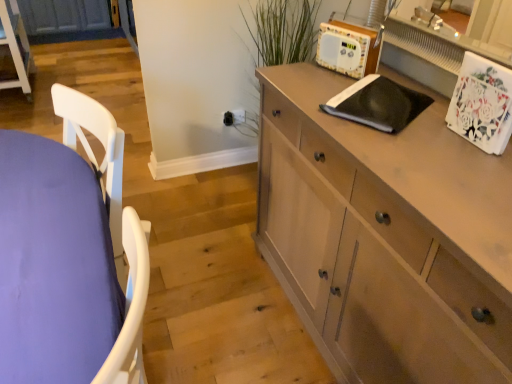
What do you see at coordinates (386, 237) in the screenshot? I see `light brown wood cabinet at right` at bounding box center [386, 237].

Image resolution: width=512 pixels, height=384 pixels. Identify the location of wooden radio at upper right. (349, 48).

Between light brown wood cabinet at right and light brown wood cabinet at lower left, which one is positioned behind?

light brown wood cabinet at lower left is behind.

Is light brown wood cabinet at right facing away from light brown wood cabinet at lower left?

light brown wood cabinet at right does not have its back to light brown wood cabinet at lower left.

From the picture: Is light brown wood cabinet at right completely or partially outside of light brown wood cabinet at lower left?

light brown wood cabinet at right is positioned outside light brown wood cabinet at lower left.

How far apart are light brown wood cabinet at right and light brown wood cabinet at lower left?

The distance of light brown wood cabinet at right from light brown wood cabinet at lower left is 3.20 meters.

Is green matte plant at upper center turned away from light brown wood cabinet at lower left?

No.

Can you see green matte plant at upper center touching light brown wood cabinet at lower left?

No, green matte plant at upper center is not touching light brown wood cabinet at lower left.

Is point (300, 44) closer to camera compared to point (1, 4)?

That is True.

Considering the relative sizes of green matte plant at upper center and light brown wood cabinet at lower left in the image provided, is green matte plant at upper center shorter than light brown wood cabinet at lower left?

Incorrect, the height of green matte plant at upper center does not fall short of that of light brown wood cabinet at lower left.

Does point (14, 2) appear closer or farther from the camera than point (33, 140)?

Point (14, 2) is farther from the camera than point (33, 140).

Where is `the chest of drawers above the purple fabric table at left (from the image's perspective)`? the chest of drawers above the purple fabric table at left (from the image's perspective) is located at coordinates (16, 47).

Is purple fabric table at left at the back of light brown wood cabinet at lower left?

That's not correct — light brown wood cabinet at lower left is not looking away from purple fabric table at left.

From the image's perspective, does light brown wood cabinet at lower left appear lower than purple fabric table at left?

No, from the image's perspective, light brown wood cabinet at lower left is not below purple fabric table at left.

In terms of height, does light brown wood cabinet at lower left look taller or shorter compared to green matte plant at upper center?

light brown wood cabinet at lower left is shorter than green matte plant at upper center.

In order to click on plant below the light brown wood cabinet at lower left (from the image's perspective) in this screenshot , I will do `click(282, 31)`.

Which object is closer to the camera, light brown wood cabinet at lower left or green matte plant at upper center?

green matte plant at upper center is in front.

Is light brown wood cabinet at lower left to the left of wooden radio at upper right from the viewer's perspective?

Indeed, light brown wood cabinet at lower left is positioned on the left side of wooden radio at upper right.

Which of these two, light brown wood cabinet at lower left or wooden radio at upper right, stands taller?

With more height is light brown wood cabinet at lower left.

From a real-world perspective, is purple fabric table at left positioned over wooden radio at upper right based on gravity?

No, from a real-world perspective, purple fabric table at left is not over wooden radio at upper right

Based on the photo, can you confirm if purple fabric table at left is smaller than wooden radio at upper right?

Incorrect, purple fabric table at left is not smaller in size than wooden radio at upper right.

In terms of height, does purple fabric table at left look taller or shorter compared to wooden radio at upper right?

purple fabric table at left is taller than wooden radio at upper right.

Is purple fabric table at left inside or outside of wooden radio at upper right?

purple fabric table at left is not inside wooden radio at upper right, it's outside.

Considering the sizes of objects light brown wood cabinet at right and wooden radio at upper right in the image provided, who is wider, light brown wood cabinet at right or wooden radio at upper right?

Wider between the two is light brown wood cabinet at right.

Between light brown wood cabinet at right and wooden radio at upper right, which one has smaller size?

Smaller between the two is wooden radio at upper right.

Is the surface of light brown wood cabinet at right in direct contact with wooden radio at upper right?

No, light brown wood cabinet at right is not in contact with wooden radio at upper right.

Is light brown wood cabinet at right outside of wooden radio at upper right?

Absolutely, light brown wood cabinet at right is external to wooden radio at upper right.

Image resolution: width=512 pixels, height=384 pixels. In the image, there is a light brown wood cabinet at right. Find the location of `the chest of drawers below it (from a real-world perspective)`. the chest of drawers below it (from a real-world perspective) is located at coordinates (16, 47).

Find the location of a particular element. plant above the light brown wood cabinet at lower left (from a real-world perspective) is located at coordinates (282, 31).

From the image, which object appears to be nearer to light brown wood cabinet at lower left, purple fabric table at left or wooden radio at upper right?

purple fabric table at left lies closer to light brown wood cabinet at lower left than the other object.

Considering their positions, is purple fabric table at left positioned further to light brown wood cabinet at lower left than light brown wood cabinet at right?

The object further to light brown wood cabinet at lower left is light brown wood cabinet at right.

Based on their spatial positions, is light brown wood cabinet at lower left or wooden radio at upper right closer to purple fabric table at left?

wooden radio at upper right lies closer to purple fabric table at left than the other object.

Which object lies further to the anchor point purple fabric table at left, light brown wood cabinet at lower left or green matte plant at upper center?

Among the two, light brown wood cabinet at lower left is located further to purple fabric table at left.

Looking at the image, which one is located further to light brown wood cabinet at lower left, light brown wood cabinet at right or green matte plant at upper center?

light brown wood cabinet at right.

Based on their spatial positions, is green matte plant at upper center or light brown wood cabinet at lower left further from purple fabric table at left?

light brown wood cabinet at lower left.

Estimate the real-world distances between objects in this image. Which object is further from wooden radio at upper right, light brown wood cabinet at lower left or purple fabric table at left?

The object further to wooden radio at upper right is light brown wood cabinet at lower left.

Based on their spatial positions, is wooden radio at upper right or light brown wood cabinet at lower left closer to purple fabric table at left?

Based on the image, wooden radio at upper right appears to be nearer to purple fabric table at left.

Where is `appliance between purple fabric table at left and light brown wood cabinet at right in the horizontal direction`? This screenshot has width=512, height=384. appliance between purple fabric table at left and light brown wood cabinet at right in the horizontal direction is located at coordinates (349, 48).

Find the location of a particular element. The image size is (512, 384). appliance located between light brown wood cabinet at right and green matte plant at upper center in the depth direction is located at coordinates (349, 48).

At what (x,y) coordinates should I click in order to perform the action: click on plant located between light brown wood cabinet at lower left and wooden radio at upper right in the left-right direction. Please return your answer as a coordinate pair (x, y). Image resolution: width=512 pixels, height=384 pixels. Looking at the image, I should click on (282, 31).

Where is `plant between light brown wood cabinet at lower left and light brown wood cabinet at right from left to right`? This screenshot has width=512, height=384. plant between light brown wood cabinet at lower left and light brown wood cabinet at right from left to right is located at coordinates (282, 31).